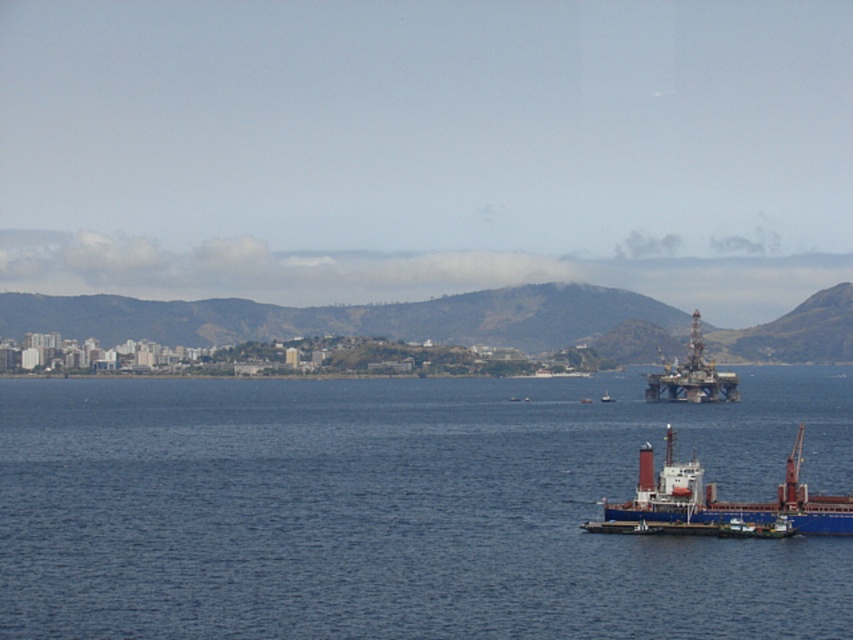
You are a pilot flying a small plane and need to land on the blue water at lower left. However, there is a metallic oil rig at upper right nearby. Based on their positions, will the oil rig block your landing path?

The blue water at lower left is located below the metallic oil rig at upper right, so the oil rig is above the landing area. This means the oil rig will not block your landing path as it is positioned higher up.

You are a photographer planning to take a photo of the coastal scene. You want to ensure both the metallic oil rig at upper right and the white plastic boat at center are clearly visible in the frame. Based on their sizes, which object should appear larger in your photo?

The metallic oil rig at upper right should appear larger in the photo because it is much taller than the white plastic boat at center.